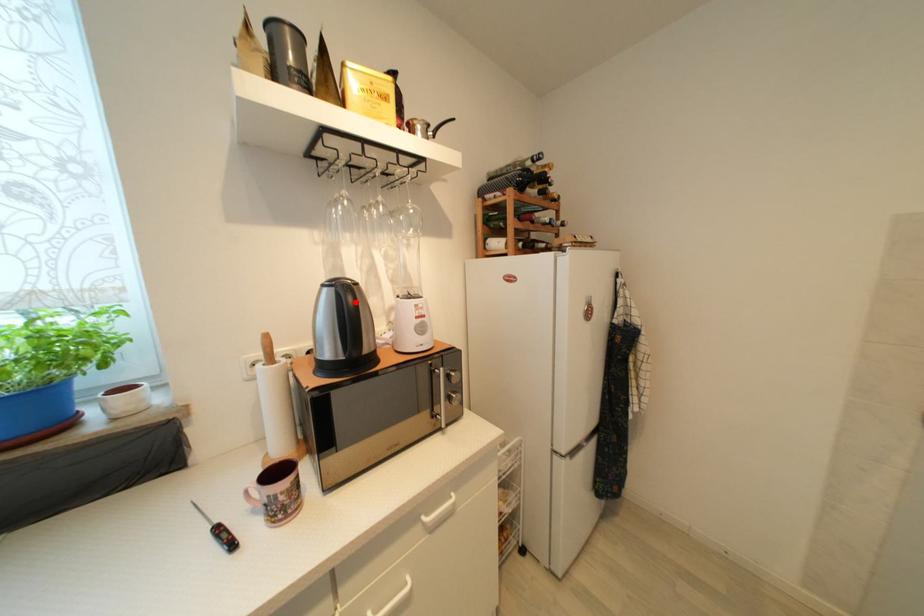
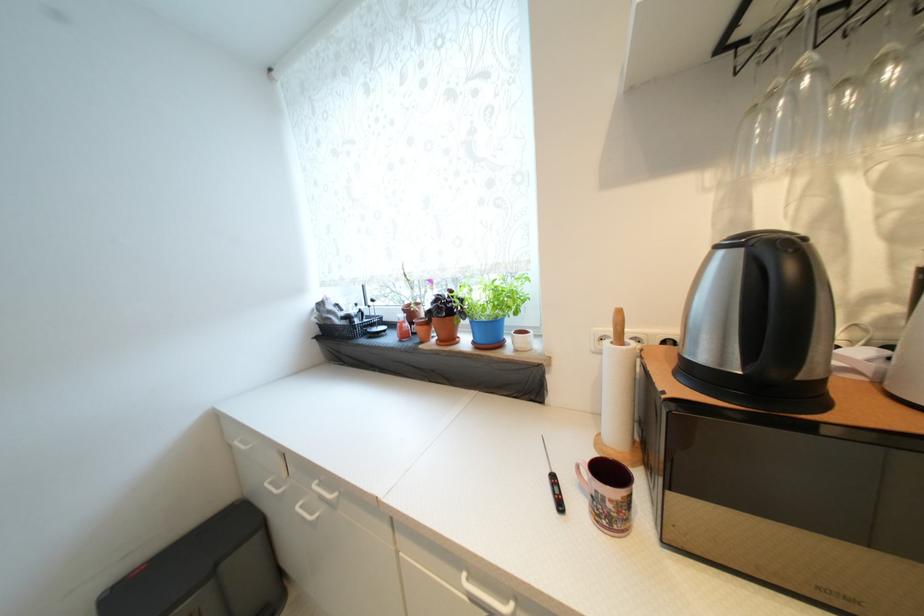
Locate, in the second image, the point that corresponds to the highlighted location in the first image.

(796, 270)